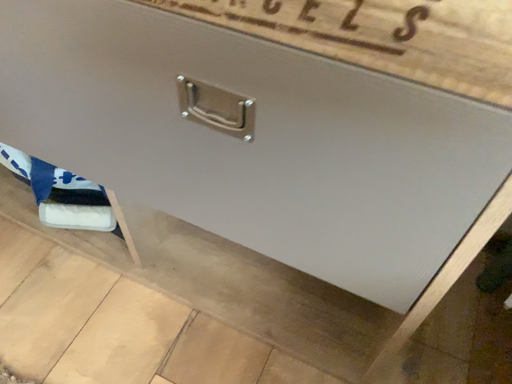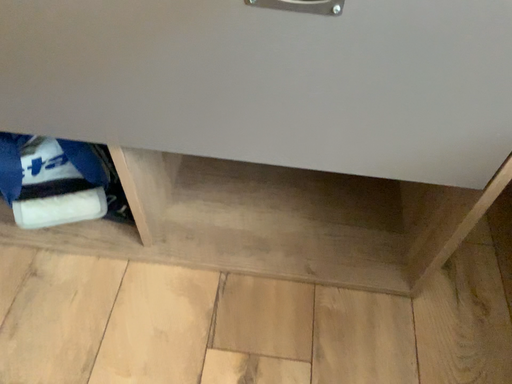
Question: How did the camera likely rotate when shooting the video?

Choices:
 (A) rotated right
 (B) rotated left

Answer: (A)